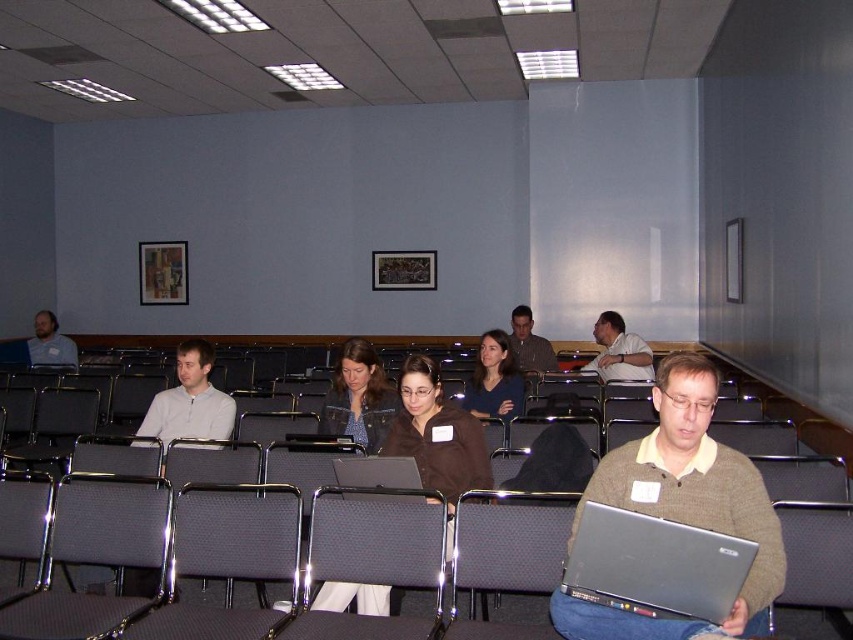
You are sitting in the back row of the conference room and want to hand a document to both the person in the matte white shirt at center and the person in the matte gray shirt at center. Which person should you approach first to ensure you can reach them without walking past the other?

You should approach the matte white shirt at center first because they are closer to you than the matte gray shirt at center, so you can reach them without needing to walk past the other person.

You are organizing a workshop and need to ensure there is enough space between the knit sweater at right and the silver metallic laptop at center for participants to move comfortably. Based on their sizes, which item requires more horizontal space?

The knit sweater at right requires more horizontal space because its width is larger than the silver metallic laptop at center.

You are sitting in the back row of the conference room and want to see the presenter at the front. There are two people in front of you at the center of the room. One is wearing a matte white shirt at center and the other is wearing a matte brown sweater at center. Which person is blocking your view more?

The matte white shirt at center is blocking your view more because it is in front of the matte brown sweater at center.